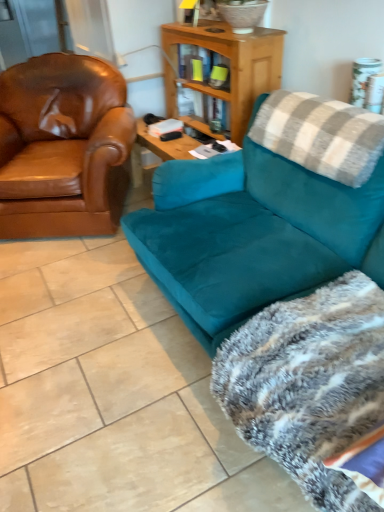
Measure the distance between point (363, 126) and camera.

Point (363, 126) is 5.24 feet from camera.

This screenshot has height=512, width=384. I want to click on fluffy gray blanket at lower right, so click(x=311, y=387).

Find the location of a particular element. This screenshot has width=384, height=512. teal suede couch at right is located at coordinates (252, 234).

Find the location of a particular element. gray plaid pillow at upper right is located at coordinates (321, 135).

Considering the relative sizes of gray plaid pillow at upper right and fluffy gray blanket at lower right in the image provided, is gray plaid pillow at upper right bigger than fluffy gray blanket at lower right?

Incorrect, gray plaid pillow at upper right is not larger than fluffy gray blanket at lower right.

Considering the relative positions of gray plaid pillow at upper right and fluffy gray blanket at lower right in the image provided, is gray plaid pillow at upper right to the left of fluffy gray blanket at lower right from the viewer's perspective?

No, gray plaid pillow at upper right is not to the left of fluffy gray blanket at lower right.

How different are the orientations of gray plaid pillow at upper right and fluffy gray blanket at lower right in degrees?

gray plaid pillow at upper right and fluffy gray blanket at lower right are facing 3.03 degrees away from each other.

From the image's perspective, would you say gray plaid pillow at upper right is positioned over fluffy gray blanket at lower right?

Yes, from the image's perspective, gray plaid pillow at upper right is above fluffy gray blanket at lower right.

From a real-world perspective, is brown leather armchair at left on teal suede couch at right?

Yes, from a real-world perspective, brown leather armchair at left is over teal suede couch at right

Is teal suede couch at right at the back of brown leather armchair at left?

brown leather armchair at left does not have its back to teal suede couch at right.

Which is correct: brown leather armchair at left is inside teal suede couch at right, or outside of it?

brown leather armchair at left is not inside teal suede couch at right, it's outside.

Can you confirm if brown leather armchair at left is taller than teal suede couch at right?

Indeed, brown leather armchair at left has a greater height compared to teal suede couch at right.

In the image, is gray plaid pillow at upper right positioned in front of or behind teal suede couch at right?

gray plaid pillow at upper right is behind teal suede couch at right.

Would you say teal suede couch at right is part of gray plaid pillow at upper right's contents?

No, gray plaid pillow at upper right does not contain teal suede couch at right.

Does point (304, 108) lie behind point (129, 227)?

No, it is not.

Considering the sizes of objects teal suede couch at right and brown leather armchair at left in the image provided, who is bigger, teal suede couch at right or brown leather armchair at left?

With larger size is teal suede couch at right.

Considering the points (233, 283) and (77, 56), which point is behind, point (233, 283) or point (77, 56)?

Point (77, 56)

Identify the location of studio couch on the right of the brown leather armchair at left. (252, 234).

Which is more to the right, fluffy gray blanket at lower right or teal suede couch at right?

fluffy gray blanket at lower right.

Considering the positions of objects fluffy gray blanket at lower right and teal suede couch at right in the image provided, who is behind, fluffy gray blanket at lower right or teal suede couch at right?

fluffy gray blanket at lower right is further from the camera.

Is fluffy gray blanket at lower right located outside teal suede couch at right?

Answer: No.

Between fluffy gray blanket at lower right and teal suede couch at right, which one has larger size?

teal suede couch at right.

From a real-world perspective, is teal suede couch at right located higher than gray plaid pillow at upper right?

No, from a real-world perspective, teal suede couch at right is not on top of gray plaid pillow at upper right.

Who is smaller, teal suede couch at right or gray plaid pillow at upper right?

gray plaid pillow at upper right.

Which object is positioned more to the left, teal suede couch at right or gray plaid pillow at upper right?

Positioned to the left is teal suede couch at right.

Is teal suede couch at right shorter than gray plaid pillow at upper right?

In fact, teal suede couch at right may be taller than gray plaid pillow at upper right.

Is point (295, 365) closer or farther from the camera than point (259, 131)?

Point (295, 365) is positioned closer to the camera compared to point (259, 131).

Is fluffy gray blanket at lower right touching gray plaid pillow at upper right?

No.

How different are the orientations of fluffy gray blanket at lower right and gray plaid pillow at upper right in degrees?

3.03 degrees separate the facing orientations of fluffy gray blanket at lower right and gray plaid pillow at upper right.

Considering the relative sizes of fluffy gray blanket at lower right and gray plaid pillow at upper right in the image provided, is fluffy gray blanket at lower right taller than gray plaid pillow at upper right?

Correct, fluffy gray blanket at lower right is much taller as gray plaid pillow at upper right.

The width and height of the screenshot is (384, 512). Identify the location of pillow behind the fluffy gray blanket at lower right. (321, 135).

What are the coordinates of `studio couch located on the right of brown leather armchair at left` in the screenshot? It's located at (252, 234).

Looking at the image, which one is located closer to teal suede couch at right, fluffy gray blanket at lower right or gray plaid pillow at upper right?

gray plaid pillow at upper right.

Based on the photo, looking at the image, which one is located closer to brown leather armchair at left, gray plaid pillow at upper right or fluffy gray blanket at lower right?

Among the two, gray plaid pillow at upper right is located nearer to brown leather armchair at left.

Based on their spatial positions, is gray plaid pillow at upper right or brown leather armchair at left further from teal suede couch at right?

brown leather armchair at left is further to teal suede couch at right.

When comparing their distances from brown leather armchair at left, does teal suede couch at right or fluffy gray blanket at lower right seem closer?

teal suede couch at right is positioned closer to the anchor brown leather armchair at left.

Estimate the real-world distances between objects in this image. Which object is closer to gray plaid pillow at upper right, fluffy gray blanket at lower right or brown leather armchair at left?

fluffy gray blanket at lower right lies closer to gray plaid pillow at upper right than the other object.

Looking at the image, which one is located closer to teal suede couch at right, brown leather armchair at left or gray plaid pillow at upper right?

Among the two, gray plaid pillow at upper right is located nearer to teal suede couch at right.

From the image, which object appears to be nearer to brown leather armchair at left, fluffy gray blanket at lower right or teal suede couch at right?

teal suede couch at right is closer to brown leather armchair at left.

Considering their positions, is gray plaid pillow at upper right positioned further to brown leather armchair at left than teal suede couch at right?

gray plaid pillow at upper right is further to brown leather armchair at left.

Where is `studio couch between brown leather armchair at left and gray plaid pillow at upper right from left to right`? Image resolution: width=384 pixels, height=512 pixels. studio couch between brown leather armchair at left and gray plaid pillow at upper right from left to right is located at coordinates (252, 234).

I want to click on blanket positioned between teal suede couch at right and gray plaid pillow at upper right from near to far, so click(x=311, y=387).

Find the location of a particular element. blanket between brown leather armchair at left and gray plaid pillow at upper right in the horizontal direction is located at coordinates (311, 387).

Locate an element on the screen. Image resolution: width=384 pixels, height=512 pixels. blanket located between teal suede couch at right and brown leather armchair at left in the depth direction is located at coordinates (311, 387).